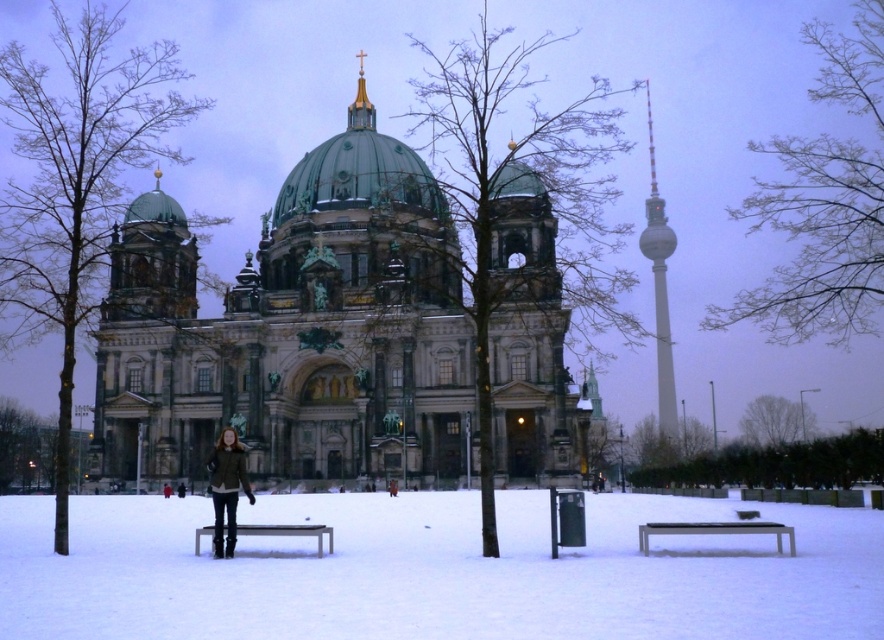
You are standing at the point marked as point (392, 552) in the image, which is 243.65 feet away from the camera. You want to take a photo of the Berlin Cathedral with the person and the bench in the foreground. Will you be able to capture both the cathedral and the person in the same frame?

Since the point (392, 552) is 243.65 feet away from the camera, and the Berlin Cathedral is a large structure, the camera should be able to capture both the cathedral and the person at that distance in the same frame, assuming a standard lens is used.